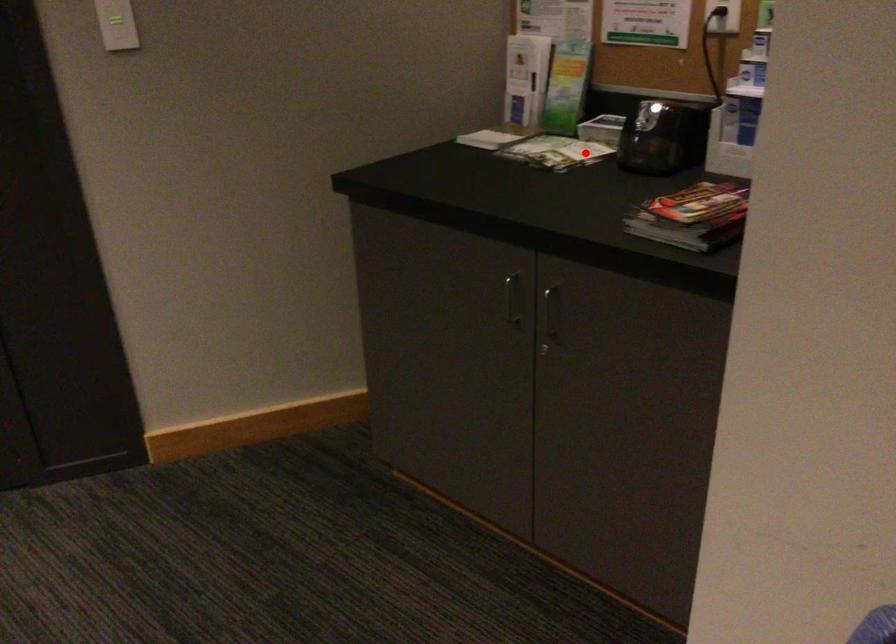
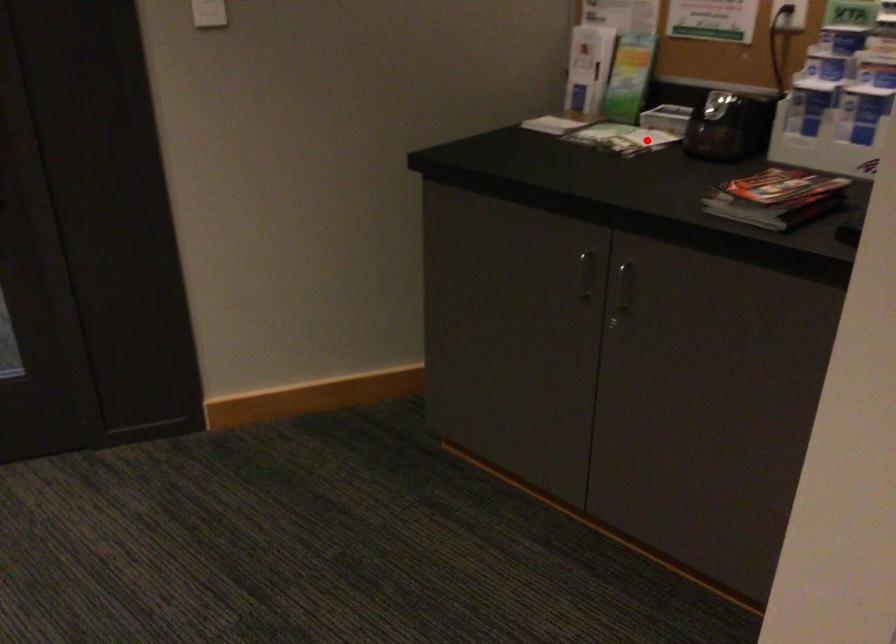
I am providing you with two images of the same scene from different viewpoints. A red point is marked on the first image and another point is marked on the second image. Are the points marked in image1 and image2 representing the same 3D position?

Yes